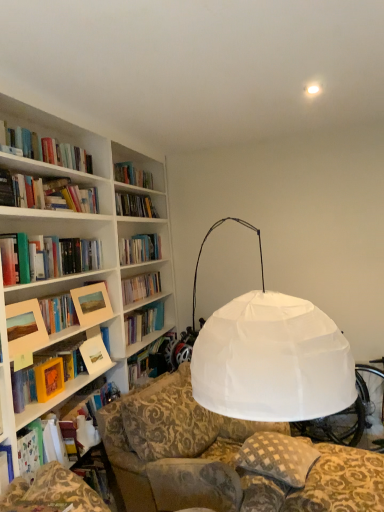
Question: Is matte wooden picture frame at upper left, placed as the 1th picture frame when sorted from right to left, bigger than yellow matte paper at left, arranged as the 1th paperback book when viewed from the front?

Choices:
 (A) no
 (B) yes

Answer: (B)

Question: Is yellow matte paper at left, the first paperback book in the left-to-right sequence, completely or partially inside matte wooden picture frame at upper left, positioned as the 2th picture frame in left-to-right order?

Choices:
 (A) no
 (B) yes

Answer: (A)

Question: Is matte wooden picture frame at upper left, the 2th picture frame viewed from the front, taller than yellow matte paper at left, the 2th paperback book when ordered from back to front?

Choices:
 (A) yes
 (B) no

Answer: (A)

Question: Does matte wooden picture frame at upper left, positioned as the 2th picture frame in left-to-right order, appear on the left side of yellow matte paper at left, the first paperback book in the left-to-right sequence?

Choices:
 (A) yes
 (B) no

Answer: (B)

Question: Considering the relative sizes of matte wooden picture frame at upper left, arranged as the first picture frame when viewed from the back, and yellow matte paper at left, marked as the second paperback book in a right-to-left arrangement, in the image provided, is matte wooden picture frame at upper left, arranged as the first picture frame when viewed from the back, shorter than yellow matte paper at left, marked as the second paperback book in a right-to-left arrangement,?

Choices:
 (A) no
 (B) yes

Answer: (A)

Question: Is matte wooden picture frame at upper left, positioned as the 2th picture frame in left-to-right order, outside of yellow matte paper at left, arranged as the 1th paperback book when viewed from the front?

Choices:
 (A) yes
 (B) no

Answer: (A)

Question: Can you confirm if matte white book at left, which is counted as the 1th paperback book, starting from the right, is wider than matte wooden picture frame at left, placed as the 1th picture frame when sorted from left to right?

Choices:
 (A) no
 (B) yes

Answer: (B)

Question: Is matte wooden picture frame at left, arranged as the 1th picture frame when viewed from the front, at the back of matte white book at left, placed as the second paperback book when sorted from front to back?

Choices:
 (A) no
 (B) yes

Answer: (A)

Question: From the image's perspective, is matte white book at left, which is counted as the 1th paperback book, starting from the right, below matte wooden picture frame at left, arranged as the 1th picture frame when viewed from the front?

Choices:
 (A) no
 (B) yes

Answer: (B)

Question: Is matte white book at left, which is counted as the 1th paperback book, starting from the right, outside of matte wooden picture frame at left, the second picture frame from the right?

Choices:
 (A) no
 (B) yes

Answer: (B)

Question: Is matte white book at left, which is counted as the 1th paperback book, starting from the right, taller than matte wooden picture frame at left, arranged as the second picture frame when viewed from the back?

Choices:
 (A) yes
 (B) no

Answer: (B)

Question: Is matte white book at left, which ranks as the 2th paperback book in left-to-right order, smaller than matte wooden picture frame at left, arranged as the 1th picture frame when viewed from the front?

Choices:
 (A) no
 (B) yes

Answer: (A)

Question: Does matte white book at left, which ranks as the 2th paperback book in left-to-right order, have a smaller size compared to yellow matte paper at left, the first paperback book in the left-to-right sequence?

Choices:
 (A) no
 (B) yes

Answer: (A)